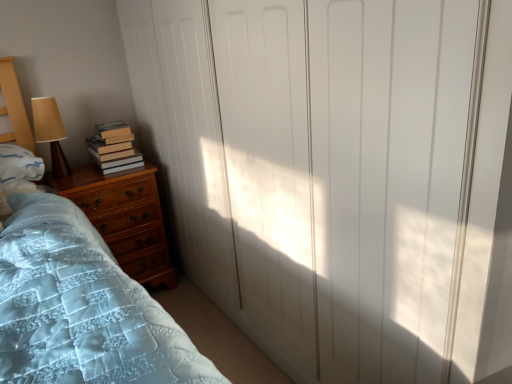
Question: From a real-world perspective, is brown fabric lampshade at left above or below white matte closet doors at center?

Choices:
 (A) above
 (B) below

Answer: (A)

Question: From the image's perspective, is brown fabric lampshade at left located above or below white matte closet doors at center?

Choices:
 (A) above
 (B) below

Answer: (A)

Question: Based on their relative distances, which object is nearer to the hardcover books at left?

Choices:
 (A) brown fabric lampshade at left
 (B) white matte closet doors at center
 (C) wooden chest of drawers at lower left

Answer: (C)

Question: Estimate the real-world distances between objects in this image. Which object is farther from the wooden chest of drawers at lower left?

Choices:
 (A) brown fabric lampshade at left
 (B) hardcover books at left
 (C) white matte closet doors at center

Answer: (C)